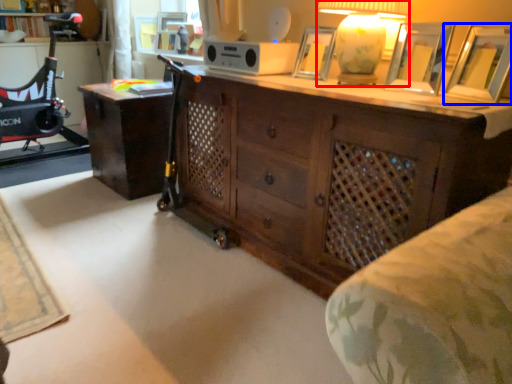
Question: Among these objects, which one is farthest to the camera, table lamp (highlighted by a red box) or picture frame (highlighted by a blue box)?

Choices:
 (A) table lamp
 (B) picture frame

Answer: (A)